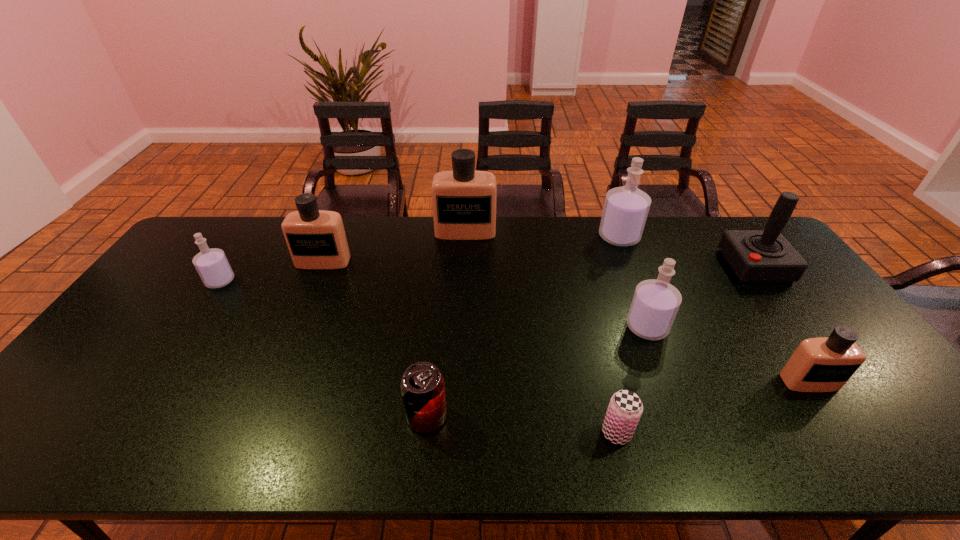
Find the location of a particular element. the nearest perfume is located at coordinates (824, 364).

Find the location of a particular element. the nearest beige perfume is located at coordinates 824,364.

At what (x,y) coordinates should I click in order to perform the action: click on soda can. Please return your answer as a coordinate pair (x, y). Looking at the image, I should click on (422, 386).

This screenshot has width=960, height=540. Find the location of `the fifth object from left to right`. the fifth object from left to right is located at coordinates (625, 408).

You are a GUI agent. You are given a task and a screenshot of the screen. Output one action in this format:
    pyautogui.click(x=<x>, y=<y>)
    Task: Click on the purple beer can
    The image size is (960, 540).
    Given the screenshot: What is the action you would take?
    pyautogui.click(x=625, y=408)

Find the location of a particular element. This screenshot has width=960, height=540. vacant space located on the front of the biggest purple perfume is located at coordinates (647, 307).

This screenshot has width=960, height=540. I want to click on vacant area located on the front label of the farthest beige perfume, so click(462, 317).

This screenshot has width=960, height=540. In order to click on vacant space situated 0.070m on the base of the joystick in this screenshot , I will do `click(705, 266)`.

Find the location of a particular element. vacant point located on the base of the joystick is located at coordinates (607, 266).

Find the location of `vacant region located 0.310m on the base of the joystick`. vacant region located 0.310m on the base of the joystick is located at coordinates (632, 266).